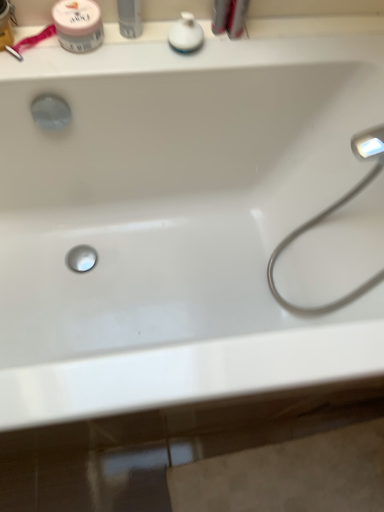
Find the location of a particular element. This screenshot has height=512, width=384. vacant space to the right of white glossy soap dispenser at upper center, which is counted as the 2th toiletry, starting from the left is located at coordinates (252, 47).